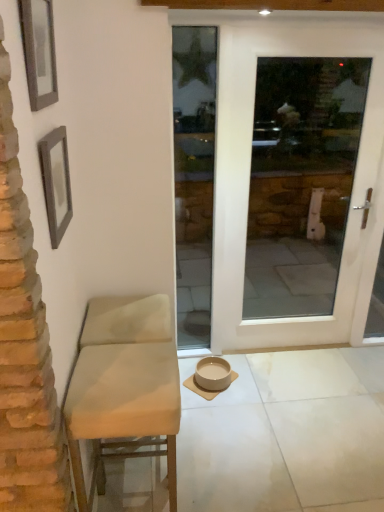
Describe the element at coordinates (39, 51) in the screenshot. The height and width of the screenshot is (512, 384). I see `wooden picture frame at upper left, which is the second picture frame from bottom to top` at that location.

Describe the element at coordinates (124, 387) in the screenshot. The height and width of the screenshot is (512, 384). I see `beige fabric chair at left` at that location.

The width and height of the screenshot is (384, 512). I want to click on gray textured frame at upper left, the second picture frame when ordered from top to bottom, so click(x=56, y=182).

Looking at this image, choose the correct answer: Is beige matte tile at center inside white glossy door at center or outside it?

beige matte tile at center is outside white glossy door at center.

Does point (258, 394) lie behind point (215, 288)?

That is False.

Is beige matte tile at center behind white glossy door at center?

Yes, beige matte tile at center is behind white glossy door at center.

Is beige matte tile at center smaller than wooden picture frame at upper left, the first picture frame in the top-to-bottom sequence?

Indeed, beige matte tile at center has a smaller size compared to wooden picture frame at upper left, the first picture frame in the top-to-bottom sequence.

Is beige matte tile at center aimed at wooden picture frame at upper left, which is the second picture frame from bottom to top?

No.

Is beige matte tile at center with wooden picture frame at upper left, which is the second picture frame from bottom to top?

beige matte tile at center and wooden picture frame at upper left, which is the second picture frame from bottom to top, are not in contact.

Is gray textured frame at upper left, the second picture frame when ordered from top to bottom, smaller than beige ceramic bowl at center?

Indeed, gray textured frame at upper left, the second picture frame when ordered from top to bottom, has a smaller size compared to beige ceramic bowl at center.

Is gray textured frame at upper left, the second picture frame when ordered from top to bottom, aimed at beige ceramic bowl at center?

No, gray textured frame at upper left, the second picture frame when ordered from top to bottom, does not turn towards beige ceramic bowl at center.

Looking at this image, considering the sizes of objects gray textured frame at upper left, the second picture frame when ordered from top to bottom, and beige ceramic bowl at center in the image provided, who is thinner, gray textured frame at upper left, the second picture frame when ordered from top to bottom, or beige ceramic bowl at center?

gray textured frame at upper left, the second picture frame when ordered from top to bottom, is thinner.

Is beige ceramic bowl at center completely or partially inside gray textured frame at upper left, the second picture frame when ordered from top to bottom?

No.

Is beige fabric chair at left at the back of gray textured frame at upper left, marked as the first picture frame in a bottom-to-top arrangement?

That's not correct — gray textured frame at upper left, marked as the first picture frame in a bottom-to-top arrangement, is not looking away from beige fabric chair at left.

This screenshot has height=512, width=384. What are the coordinates of `chair that appears behind the gray textured frame at upper left, marked as the first picture frame in a bottom-to-top arrangement` in the screenshot? It's located at (124, 387).

In the scene shown: Can you confirm if gray textured frame at upper left, marked as the first picture frame in a bottom-to-top arrangement, is thinner than beige fabric chair at left?

Yes.

Does point (189, 358) lie in front of point (56, 178)?

That is False.

Is beige matte tile at center in contact with gray textured frame at upper left, the second picture frame when ordered from top to bottom?

No, beige matte tile at center is not beside gray textured frame at upper left, the second picture frame when ordered from top to bottom.

Between beige matte tile at center and gray textured frame at upper left, the second picture frame when ordered from top to bottom, which one is positioned behind?

beige matte tile at center.

From the image's perspective, is beige matte tile at center beneath gray textured frame at upper left, marked as the first picture frame in a bottom-to-top arrangement?

Yes.

Is there a large distance between beige ceramic bowl at center and beige matte tile at center?

No, beige ceramic bowl at center is not far away from beige matte tile at center.

From a real-world perspective, is beige ceramic bowl at center on top of beige matte tile at center?

Yes, from a real-world perspective, beige ceramic bowl at center is on top of beige matte tile at center.

Is beige ceramic bowl at center positioned with its back to beige matte tile at center?

No.

Would you say white glossy door at center is a long distance from beige matte tile at center?

white glossy door at center is near beige matte tile at center, not far away.

Does point (244, 205) come behind point (254, 390)?

No, it is in front of (254, 390).

How distant is white glossy door at center from beige matte tile at center?

white glossy door at center and beige matte tile at center are 30.22 inches apart.

From a real-world perspective, between white glossy door at center and beige matte tile at center, who is vertically lower?

In real-world perspective, beige matte tile at center is lower.

At what (x,y) coordinates should I click in order to perform the action: click on tile below the white glossy door at center (from a real-world perspective). Please return your answer as a coordinate pair (x, y). The image size is (384, 512). Looking at the image, I should click on (240, 383).

I want to click on tile lying on the right of wooden picture frame at upper left, the first picture frame in the top-to-bottom sequence, so coord(240,383).

Estimate the real-world distances between objects in this image. Which object is closer to white glossy door at center, beige matte tile at center or gray textured frame at upper left, marked as the first picture frame in a bottom-to-top arrangement?

beige matte tile at center lies closer to white glossy door at center than the other object.

From the image, which object appears to be farther from beige ceramic bowl at center, white glossy door at center or beige fabric chair at left?

The object further to beige ceramic bowl at center is beige fabric chair at left.

Estimate the real-world distances between objects in this image. Which object is further from beige ceramic bowl at center, white glossy door at center or beige matte tile at center?

Based on the image, white glossy door at center appears to be further to beige ceramic bowl at center.

Which object lies further to the anchor point beige fabric chair at left, white glossy door at center or gray textured frame at upper left, the second picture frame when ordered from top to bottom?

white glossy door at center.

Which object lies nearer to the anchor point white glossy door at center, beige fabric chair at left or gray textured frame at upper left, the second picture frame when ordered from top to bottom?

beige fabric chair at left is positioned closer to the anchor white glossy door at center.

Considering their positions, is wooden picture frame at upper left, the first picture frame in the top-to-bottom sequence, positioned further to beige fabric chair at left than beige matte tile at center?

The object further to beige fabric chair at left is beige matte tile at center.

Looking at the image, which one is located further to wooden picture frame at upper left, which is the second picture frame from bottom to top, beige fabric chair at left or gray textured frame at upper left, marked as the first picture frame in a bottom-to-top arrangement?

Among the two, beige fabric chair at left is located further to wooden picture frame at upper left, which is the second picture frame from bottom to top.

Considering their positions, is beige matte tile at center positioned further to wooden picture frame at upper left, the first picture frame in the top-to-bottom sequence, than white glossy door at center?

beige matte tile at center is positioned further to the anchor wooden picture frame at upper left, the first picture frame in the top-to-bottom sequence.

Where is `door between gray textured frame at upper left, the second picture frame when ordered from top to bottom, and beige ceramic bowl at center from front to back`? door between gray textured frame at upper left, the second picture frame when ordered from top to bottom, and beige ceramic bowl at center from front to back is located at coordinates (248, 181).

Where is `tile located between gray textured frame at upper left, marked as the first picture frame in a bottom-to-top arrangement, and beige ceramic bowl at center in the depth direction`? Image resolution: width=384 pixels, height=512 pixels. tile located between gray textured frame at upper left, marked as the first picture frame in a bottom-to-top arrangement, and beige ceramic bowl at center in the depth direction is located at coordinates (240, 383).

The width and height of the screenshot is (384, 512). Find the location of `door between gray textured frame at upper left, the second picture frame when ordered from top to bottom, and beige matte tile at center in the front-back direction`. door between gray textured frame at upper left, the second picture frame when ordered from top to bottom, and beige matte tile at center in the front-back direction is located at coordinates (248, 181).

You are a GUI agent. You are given a task and a screenshot of the screen. Output one action in this format:
    pyautogui.click(x=<x>, y=<y>)
    Task: Click on the chair positioned between gray textured frame at upper left, the second picture frame when ordered from top to bottom, and beige ceramic bowl at center from near to far
    This screenshot has width=384, height=512.
    Given the screenshot: What is the action you would take?
    pyautogui.click(x=124, y=387)